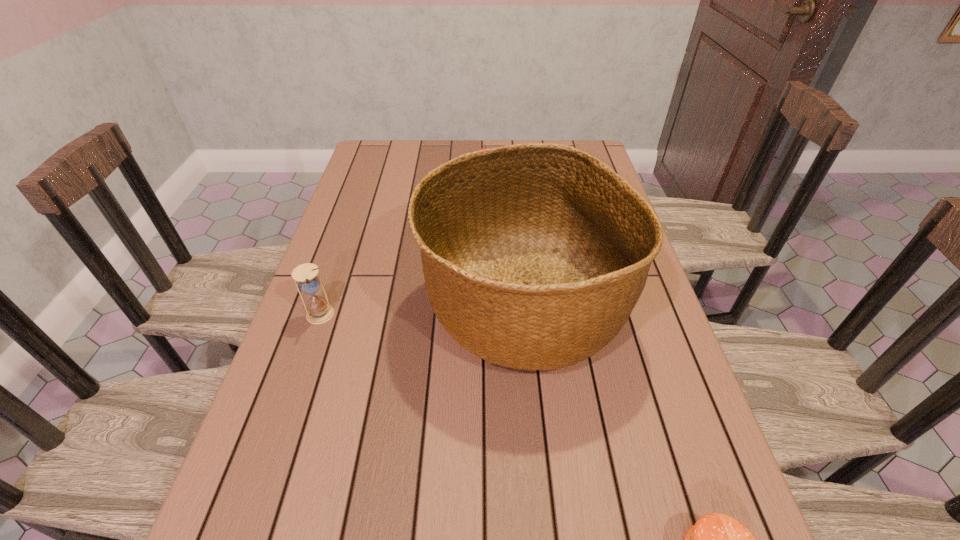
What are the coordinates of `the tallest object` in the screenshot? It's located at (534, 255).

You are a GUI agent. You are given a task and a screenshot of the screen. Output one action in this format:
    pyautogui.click(x=<x>, y=<y>)
    Task: Click on the leftmost object
    The width and height of the screenshot is (960, 540).
    Given the screenshot: What is the action you would take?
    pyautogui.click(x=318, y=312)

Where is `the second tallest object`? The height and width of the screenshot is (540, 960). the second tallest object is located at coordinates (318, 312).

The width and height of the screenshot is (960, 540). What are the coordinates of `apple` in the screenshot? It's located at (485, 146).

At what (x,y) coordinates should I click in order to perform the action: click on the farthest object. Please return your answer as a coordinate pair (x, y). Looking at the image, I should click on tap(485, 146).

Where is `free space located 0.250m on the back of the basket`? free space located 0.250m on the back of the basket is located at coordinates [x=513, y=194].

At what (x,y) coordinates should I click in order to perform the action: click on blank space located 0.390m on the right of the hourglass. Please return your answer as a coordinate pair (x, y). The height and width of the screenshot is (540, 960). Looking at the image, I should click on (497, 315).

You are a GUI agent. You are given a task and a screenshot of the screen. Output one action in this format:
    pyautogui.click(x=<x>, y=<y>)
    Task: Click on the free spot located 0.130m on the left of the farthest object
    This screenshot has height=540, width=960.
    Given the screenshot: What is the action you would take?
    pyautogui.click(x=431, y=178)

The width and height of the screenshot is (960, 540). In order to click on object that is at the far edge in this screenshot , I will do `click(485, 146)`.

This screenshot has height=540, width=960. Find the location of `object at the left edge`. object at the left edge is located at coordinates (318, 312).